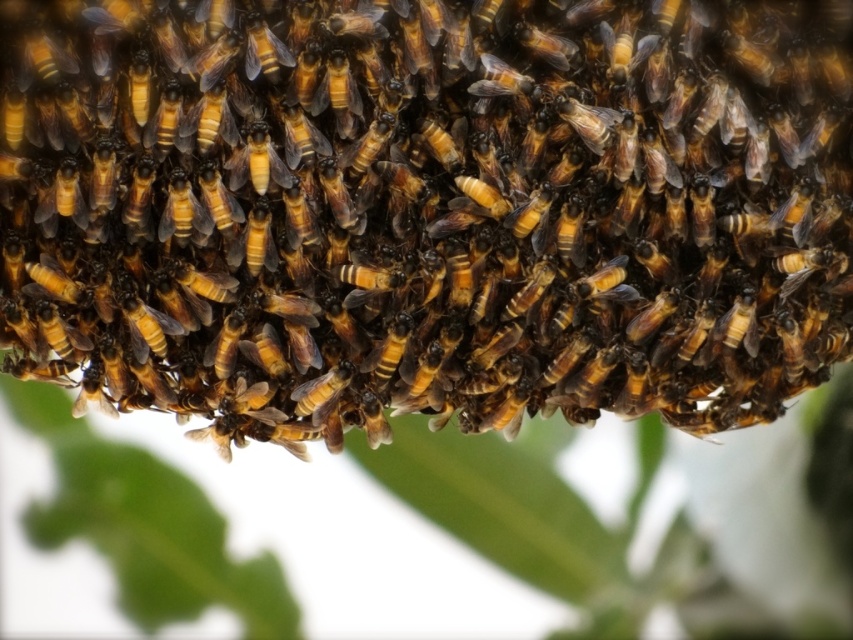
Which is behind, point (39, 44) or point (186, 211)?

Point (186, 211)

Is brown fuzzy beehive at center to the left of shiny golden bee at center from the viewer's perspective?

In fact, brown fuzzy beehive at center is to the right of shiny golden bee at center.

In order to click on brown fuzzy beehive at center in this screenshot , I will do `click(427, 209)`.

Identify the location of brown fuzzy beehive at center. This screenshot has width=853, height=640. (427, 209).

Which of these two, shiny golden bee at center or brown fuzzy bee at center, stands taller?

With more height is shiny golden bee at center.

Locate an element on the screen. The width and height of the screenshot is (853, 640). shiny golden bee at center is located at coordinates (183, 212).

Which is in front, point (173, 186) or point (311, 404)?

Point (173, 186) is in front.

Where is `shiny golden bee at center`? The height and width of the screenshot is (640, 853). shiny golden bee at center is located at coordinates (183, 212).

Is point (187, 276) positioned before point (321, 378)?

Yes, point (187, 276) is in front of point (321, 378).

The height and width of the screenshot is (640, 853). What do you see at coordinates (427, 209) in the screenshot? I see `brown fuzzy beehive at center` at bounding box center [427, 209].

The width and height of the screenshot is (853, 640). Find the location of `brown fuzzy beehive at center`. brown fuzzy beehive at center is located at coordinates (427, 209).